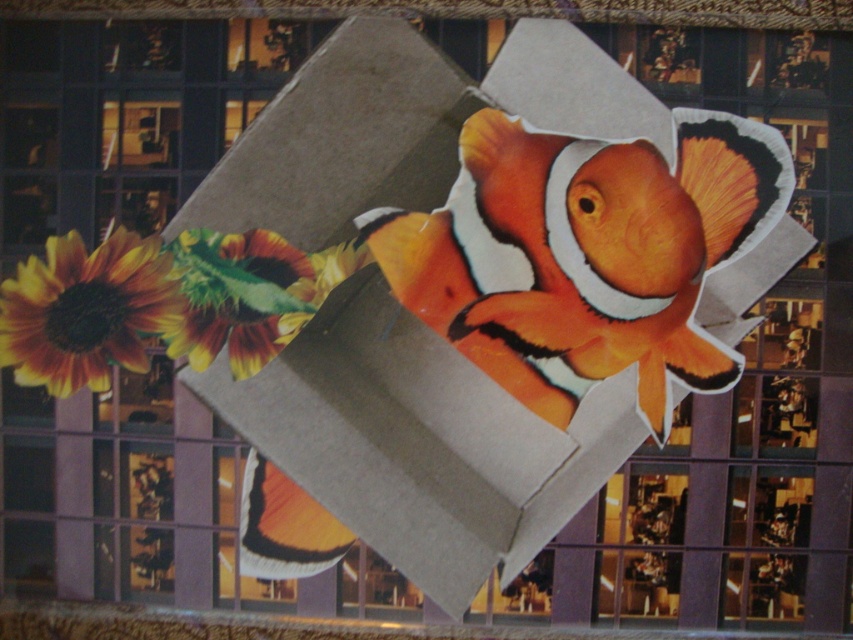
Question: In this image, where is matte gray cardboard box at center located relative to orange matte clownfish at center?

Choices:
 (A) left
 (B) right

Answer: (A)

Question: Which object is closer to the camera taking this photo?

Choices:
 (A) yellow-green textured leaf at lower left
 (B) yellow matte sunflower at lower left

Answer: (A)

Question: Which point appears closest to the camera in this image?

Choices:
 (A) (517, 291)
 (B) (143, 243)
 (C) (259, 301)
 (D) (662, 106)

Answer: (D)

Question: Which point is closer to the camera taking this photo?

Choices:
 (A) (103, 340)
 (B) (410, 99)
 (C) (729, 195)

Answer: (B)

Question: Is yellow matte sunflower at lower left behind yellow-green textured leaf at lower left?

Choices:
 (A) yes
 (B) no

Answer: (A)

Question: Does orange matte clownfish at center appear under yellow-green textured leaf at lower left?

Choices:
 (A) no
 (B) yes

Answer: (A)